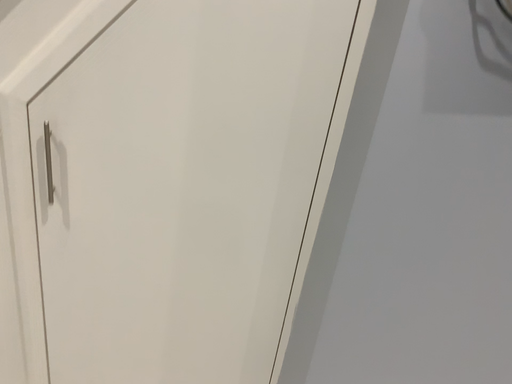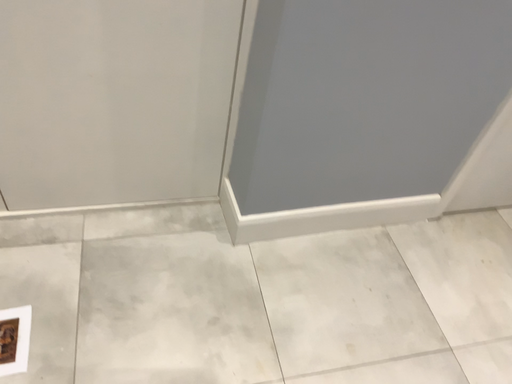
Question: Which way did the camera rotate in the video?

Choices:
 (A) rotated left
 (B) rotated right

Answer: (B)